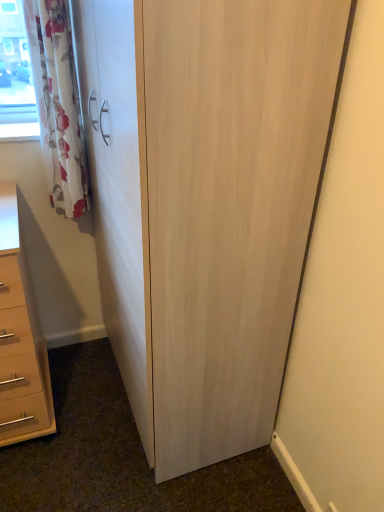
Where is `free area in between matte beige chest of drawers at lower left and light wood cupboard at center`? free area in between matte beige chest of drawers at lower left and light wood cupboard at center is located at coordinates (83, 412).